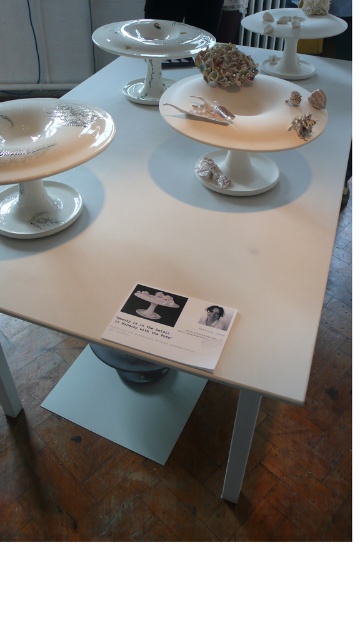
From the picture: Can you confirm if white glossy saucer at lower left is thinner than shiny metallic seashell at center?

In fact, white glossy saucer at lower left might be wider than shiny metallic seashell at center.

Which of these two, white glossy saucer at lower left or shiny metallic seashell at center, stands taller?

white glossy saucer at lower left is taller.

Is point (36, 236) positioned in front of point (285, 100)?

Yes.

I want to click on white glossy saucer at lower left, so click(x=38, y=209).

Between white glossy plate at center and shiny metallic seashell at center, which one has less height?

shiny metallic seashell at center

Is point (302, 99) more distant than point (290, 104)?

Yes, it is.

Between point (219, 154) and point (299, 93), which one is positioned in front?

Point (299, 93) is in front.

At what (x,y) coordinates should I click in order to perform the action: click on white glossy plate at center. Please return your answer as a coordinate pair (x, y). This screenshot has height=640, width=360. Looking at the image, I should click on (241, 125).

Does point (313, 118) lie behind point (253, 179)?

No, (313, 118) is in front of (253, 179).

Between white glossy plate at center and white glossy saucer at center, which one is positioned higher?

white glossy plate at center is higher up.

Between point (210, 122) and point (222, 186), which one is positioned behind?

The point (222, 186) is more distant.

What are the coordinates of `white glossy plate at center` in the screenshot? It's located at (241, 125).